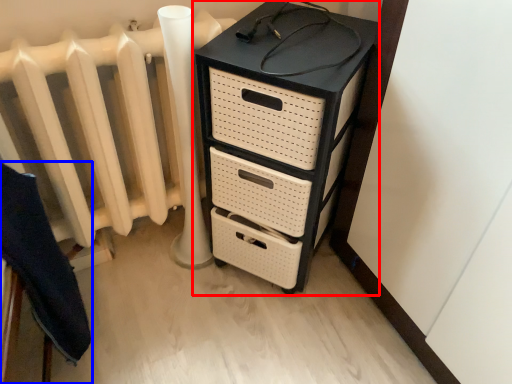
Question: Which point is further to the camera, chest of drawers (highlighted by a red box) or furniture (highlighted by a blue box)?

Choices:
 (A) chest of drawers
 (B) furniture

Answer: (A)